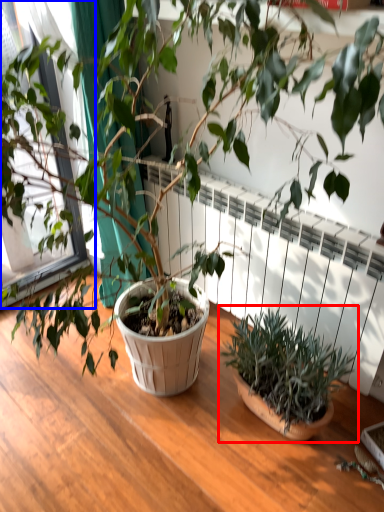
Question: Which object appears closest to the camera in this image, houseplant (highlighted by a red box) or window frame (highlighted by a blue box)?

Choices:
 (A) houseplant
 (B) window frame

Answer: (A)